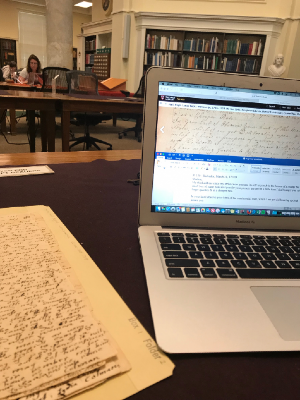
Locate an element on the screen. The width and height of the screenshot is (300, 400). laptop screen is located at coordinates (206, 162).